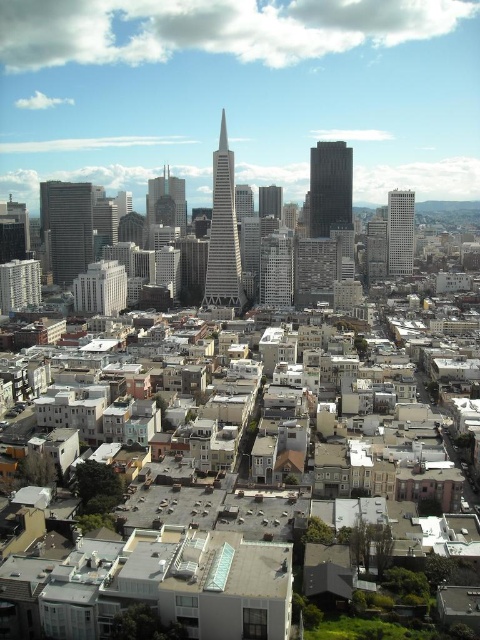
Question: Which object is the farthest from the black glass skyscraper at center?

Choices:
 (A) dark gray concrete skyscraper at left
 (B) white glass skyscraper at center-right
 (C) glassy steel skyscraper at center

Answer: (A)

Question: From the image, what is the correct spatial relationship of dark gray concrete skyscraper at left in relation to glassy steel skyscraper at center?

Choices:
 (A) above
 (B) below

Answer: (B)

Question: Which point appears closest to the camera in this image?

Choices:
 (A) (324, 224)
 (B) (276, 202)
 (C) (176, 216)
 (D) (72, 202)

Answer: (B)

Question: In this image, where is silver glass skyscraper at center located relative to white glass skyscraper at center-right?

Choices:
 (A) left
 (B) right

Answer: (A)

Question: In this image, where is black glass skyscraper at center located relative to glassy steel skyscraper at center?

Choices:
 (A) left
 (B) right

Answer: (B)

Question: Which point appears farthest from the camera in this image?

Choices:
 (A) (159, 179)
 (B) (396, 216)
 (C) (313, 170)
 (D) (280, 202)

Answer: (B)